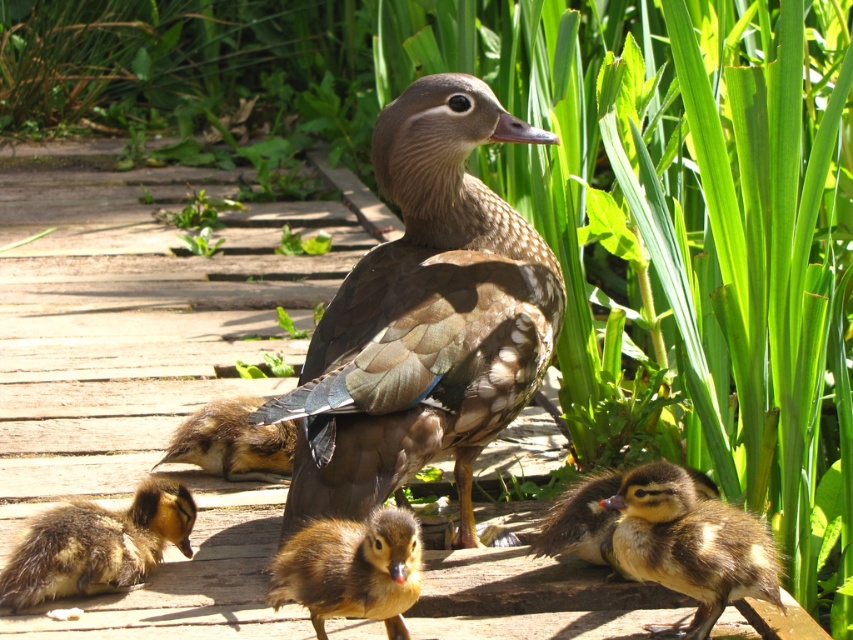
Question: Considering the relative positions of brown fuzzy duckling at center and brown fuzzy duckling at lower right in the image provided, where is brown fuzzy duckling at center located with respect to brown fuzzy duckling at lower right?

Choices:
 (A) right
 (B) left

Answer: (B)

Question: Which point is farther from the camera taking this photo?

Choices:
 (A) (604, 531)
 (B) (621, 524)
 (C) (345, 566)

Answer: (A)

Question: Is brown fuzzy duckling at lower center to the left of brown fuzzy duckling at lower left from the viewer's perspective?

Choices:
 (A) no
 (B) yes

Answer: (A)

Question: Which object is the closest to the brown fuzzy duckling at lower right?

Choices:
 (A) brown speckled feathers at center
 (B) brown fuzzy duckling at center
 (C) brown fluffy duckling at lower left
 (D) brown fuzzy duckling at lower left

Answer: (A)

Question: Does brown speckled feathers at center lie in front of brown fuzzy duckling at lower right?

Choices:
 (A) yes
 (B) no

Answer: (A)

Question: Which of these objects is positioned closest to the brown fuzzy duckling at lower left?

Choices:
 (A) brown fuzzy duckling at center
 (B) brown fluffy duckling at lower left

Answer: (B)